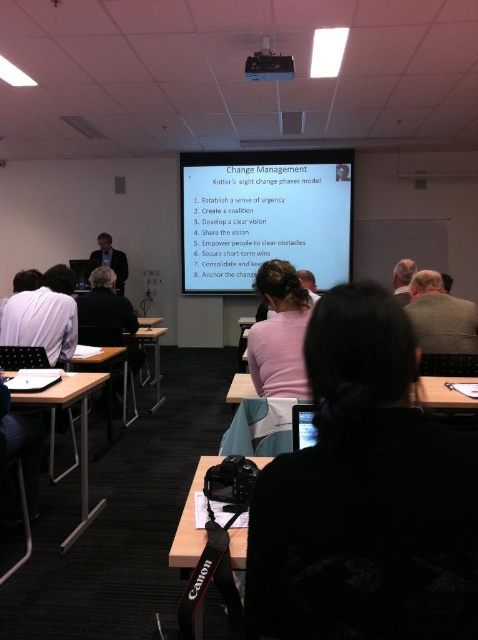
Question: Considering the relative positions of wooden table at center and dark suit at center in the image provided, where is wooden table at center located with respect to dark suit at center?

Choices:
 (A) left
 (B) right

Answer: (B)

Question: Which object is positioned farthest from the white matte projector screen at upper center?

Choices:
 (A) black plastic projector at upper center
 (B) wooden table at center
 (C) black fabric at center
 (D) gray woolen sweater at right

Answer: (C)

Question: Among these points, which one is nearest to the camera?

Choices:
 (A) (400, 385)
 (B) (149, 330)

Answer: (A)

Question: Does white fabric laptop at left lie in front of gray hair at upper right?

Choices:
 (A) no
 (B) yes

Answer: (B)

Question: Which point is farther from the camera taking this photo?

Choices:
 (A) (263, 394)
 (B) (73, 380)

Answer: (B)

Question: Does white matte projector screen at upper center have a smaller size compared to dark suit at center?

Choices:
 (A) yes
 (B) no

Answer: (B)